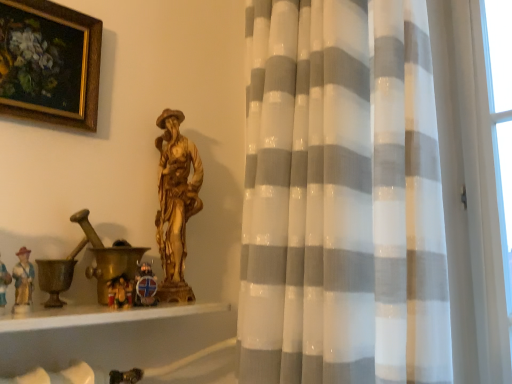
Question: Is white sheer curtain at center taller or shorter than gold-framed painting at upper left?

Choices:
 (A) short
 (B) tall

Answer: (B)

Question: Is white sheer curtain at center inside the boundaries of gold-framed painting at upper left, or outside?

Choices:
 (A) outside
 (B) inside

Answer: (A)

Question: Estimate the real-world distances between objects in this image. Which object is farther from the gold-framed painting at upper left?

Choices:
 (A) white sheer curtain at center
 (B) white glossy wood at lower left

Answer: (A)

Question: Which object is the closest to the white sheer curtain at center?

Choices:
 (A) white glossy wood at lower left
 (B) gold-framed painting at upper left

Answer: (A)